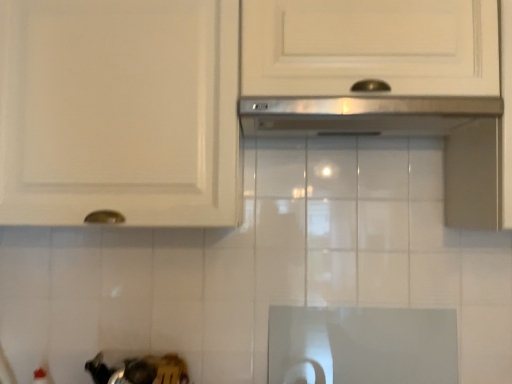
Question: Would you say white glossy cabinet at upper center is to the left or to the right of stainless steel exhaust hood at center in the picture?

Choices:
 (A) left
 (B) right

Answer: (A)

Question: Considering their positions, is white glossy cabinet at upper center located in front of or behind stainless steel exhaust hood at center?

Choices:
 (A) behind
 (B) front

Answer: (A)

Question: From the image's perspective, is white glossy cabinet at upper center positioned above or below stainless steel exhaust hood at center?

Choices:
 (A) above
 (B) below

Answer: (A)

Question: Choose the correct answer: Is stainless steel exhaust hood at center inside white glossy cabinet at upper center or outside it?

Choices:
 (A) outside
 (B) inside

Answer: (B)

Question: From a real-world perspective, relative to white glossy cabinet at upper center, is stainless steel exhaust hood at center vertically above or below?

Choices:
 (A) above
 (B) below

Answer: (B)

Question: Does point (309, 117) appear closer or farther from the camera than point (435, 96)?

Choices:
 (A) farther
 (B) closer

Answer: (A)

Question: In the image, is stainless steel exhaust hood at center positioned in front of or behind white glossy cabinet at upper center?

Choices:
 (A) front
 (B) behind

Answer: (A)